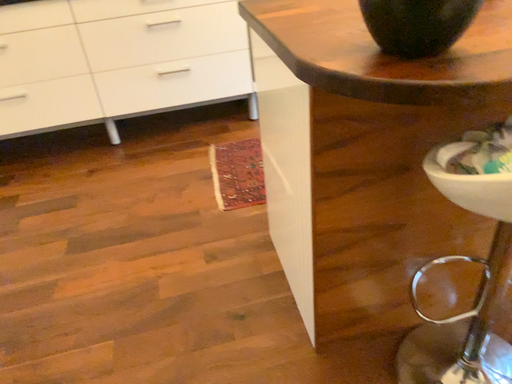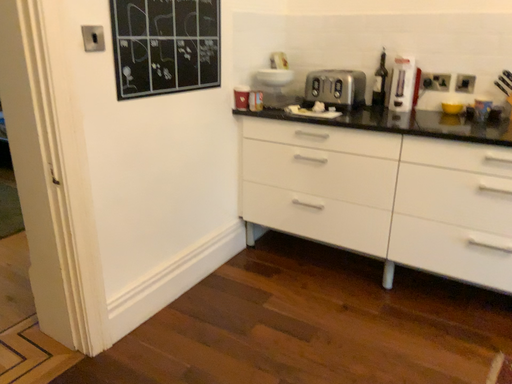
Question: Which way did the camera rotate in the video?

Choices:
 (A) rotated left
 (B) rotated right

Answer: (A)